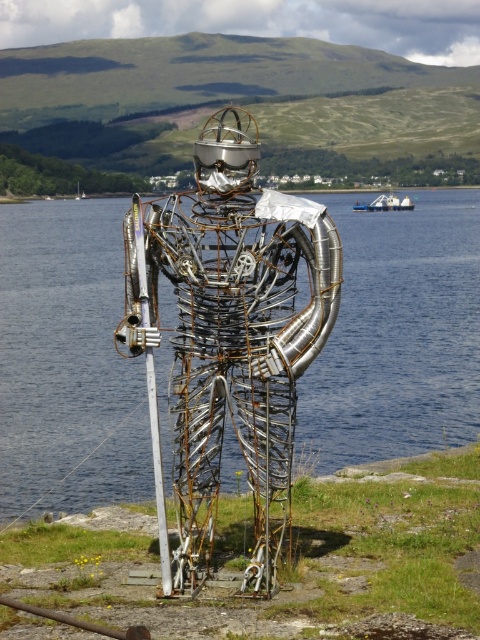
You are standing at the edge of the water and want to take a photo of the rusty metal sculpture at center. If your camera has a maximum focus range of 30 feet, will you be able to capture the sculpture clearly?

The rusty metal sculpture at center is 29.84 feet away from the viewer. Since the camera can focus up to 30 feet, you can capture the sculpture clearly within the focus range.

You are a drone operator trying to capture the sculpture from above. The sculpture is positioned near the blue metallic water at center. To ensure the water is in the lower third of the frame, should you adjust your drone to fly higher or lower?

The blue metallic water at center is located at point coordinates that place it lower in the image. To position it in the lower third of the frame, you should fly the drone slightly higher to pull back and ensure the water remains in the lower portion without being cut off.